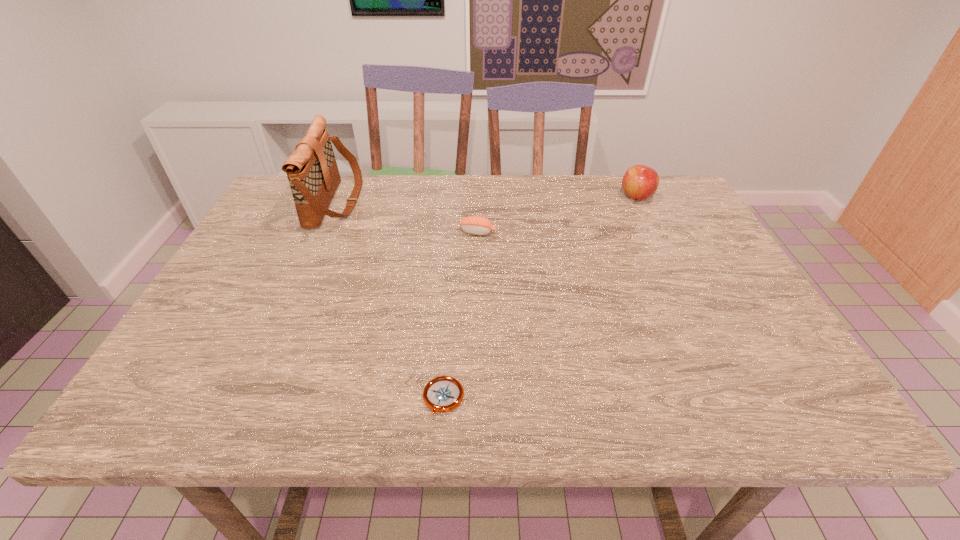
The height and width of the screenshot is (540, 960). I want to click on free space at the right edge of the desktop, so click(x=690, y=221).

The width and height of the screenshot is (960, 540). Find the location of `blank area at the far left corner`. blank area at the far left corner is located at coordinates (275, 191).

In the image, there is a desktop. Identify the location of vacant space at the near left corner. (209, 402).

This screenshot has height=540, width=960. What are the coordinates of `blank area at the far right corner` in the screenshot? It's located at (684, 206).

The width and height of the screenshot is (960, 540). In the image, there is a desktop. What are the coordinates of `vacant space at the near right corner` in the screenshot? It's located at (757, 391).

Image resolution: width=960 pixels, height=540 pixels. What are the coordinates of `free space between the sushi and the tallest object` in the screenshot? It's located at (407, 217).

This screenshot has width=960, height=540. I want to click on free space that is in between the shortest object and the sushi, so click(x=461, y=315).

Locate an element on the screen. vacant space in between the third tallest object and the third shortest object is located at coordinates (557, 214).

I want to click on vacant space in between the shortest object and the third tallest object, so click(x=461, y=315).

At what (x,y) coordinates should I click in order to perform the action: click on free space between the compass and the shoulder bag. Please return your answer as a coordinate pair (x, y). The image size is (960, 540). Looking at the image, I should click on (390, 300).